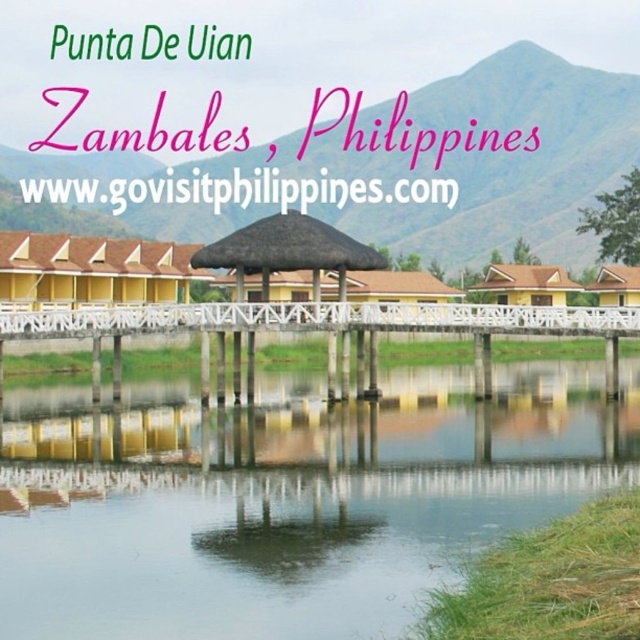
Question: Considering the real-world distances, which object is farthest from the white wooden dock at center?

Choices:
 (A) yellow corrugated metal hut at center
 (B) brown thatched roof hut at center
 (C) yellow matte hut at lower right
 (D) transparent water at center

Answer: (C)

Question: Which object is farther from the camera taking this photo?

Choices:
 (A) brown thatched roof hut at center
 (B) transparent water at center
 (C) white wooden dock at center

Answer: (A)

Question: Among these objects, which one is nearest to the camera?

Choices:
 (A) white wooden dock at center
 (B) brown thatched roof hut at center
 (C) yellow matte hut at lower right

Answer: (A)

Question: Is yellow corrugated metal hut at center smaller than brown thatched roof hut at center?

Choices:
 (A) yes
 (B) no

Answer: (B)

Question: Where is transparent water at center located in relation to yellow corrugated metal hut at center in the image?

Choices:
 (A) above
 (B) below

Answer: (B)

Question: In this image, where is transparent water at center located relative to yellow corrugated metal hut at center?

Choices:
 (A) left
 (B) right

Answer: (B)